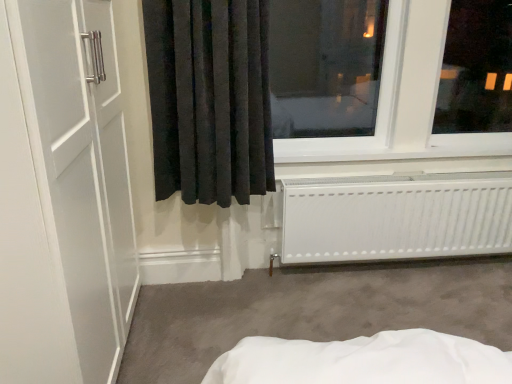
Question: Is the position of white matte radiator at lower right less distant than that of black velvet curtain at center?

Choices:
 (A) no
 (B) yes

Answer: (A)

Question: Does white matte radiator at lower right turn towards black velvet curtain at center?

Choices:
 (A) yes
 (B) no

Answer: (B)

Question: Can you confirm if white matte radiator at lower right is taller than black velvet curtain at center?

Choices:
 (A) yes
 (B) no

Answer: (B)

Question: From the image's perspective, would you say white matte radiator at lower right is positioned over black velvet curtain at center?

Choices:
 (A) yes
 (B) no

Answer: (B)

Question: From a real-world perspective, is white matte radiator at lower right under black velvet curtain at center?

Choices:
 (A) no
 (B) yes

Answer: (B)

Question: In terms of width, does black velvet curtain at center look wider or thinner when compared to transparent glass window at upper right?

Choices:
 (A) thin
 (B) wide

Answer: (A)

Question: Is black velvet curtain at center in front of or behind transparent glass window at upper right in the image?

Choices:
 (A) behind
 (B) front

Answer: (B)

Question: From a real-world perspective, is black velvet curtain at center physically located above or below transparent glass window at upper right?

Choices:
 (A) below
 (B) above

Answer: (A)

Question: Is black velvet curtain at center bigger or smaller than transparent glass window at upper right?

Choices:
 (A) big
 (B) small

Answer: (B)

Question: Is white plastic window sill at lower center inside the boundaries of transparent glass window at upper right, or outside?

Choices:
 (A) inside
 (B) outside

Answer: (B)

Question: From the image's perspective, relative to transparent glass window at upper right, is white plastic window sill at lower center above or below?

Choices:
 (A) below
 (B) above

Answer: (A)

Question: Considering the positions of point (318, 162) and point (425, 144), is point (318, 162) closer or farther from the camera than point (425, 144)?

Choices:
 (A) farther
 (B) closer

Answer: (B)

Question: Based on their sizes in the image, would you say white plastic window sill at lower center is bigger or smaller than transparent glass window at upper right?

Choices:
 (A) big
 (B) small

Answer: (B)

Question: Which is correct: black velvet curtain at center is inside white plastic window sill at lower center, or outside of it?

Choices:
 (A) outside
 (B) inside

Answer: (A)

Question: From a real-world perspective, is black velvet curtain at center above or below white plastic window sill at lower center?

Choices:
 (A) above
 (B) below

Answer: (A)